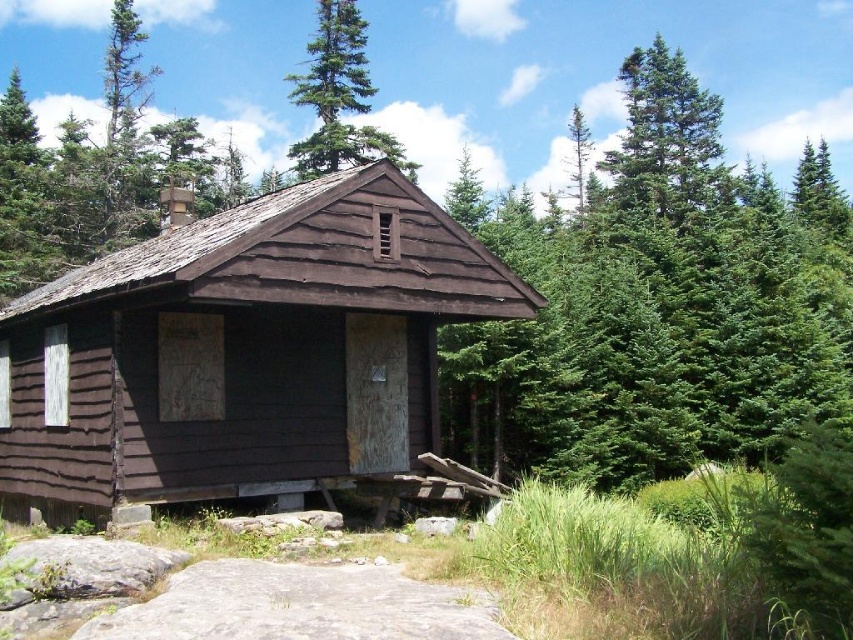
Is the position of brown wooden cabin at center less distant than that of green coniferous tree at upper center?

That is True.

Does point (213, 332) lie behind point (339, 42)?

No, (213, 332) is in front of (339, 42).

At what (x,y) coordinates should I click in order to perform the action: click on brown wooden cabin at center. Please return your answer as a coordinate pair (x, y). The height and width of the screenshot is (640, 853). Looking at the image, I should click on tap(244, 349).

The height and width of the screenshot is (640, 853). In order to click on green evergreen tree at center in this screenshot , I will do `click(654, 305)`.

Is green evergreen tree at center positioned before green coniferous tree at upper center?

Yes, green evergreen tree at center is closer to the viewer.

Find the location of a particular element. green evergreen tree at center is located at coordinates (654, 305).

Who is more forward, (229, 240) or (746, 275)?

Positioned in front is point (229, 240).

What do you see at coordinates (244, 349) in the screenshot? I see `brown wooden cabin at center` at bounding box center [244, 349].

Is point (173, 300) positioned in front of point (614, 336)?

That is True.

You are a GUI agent. You are given a task and a screenshot of the screen. Output one action in this format:
    pyautogui.click(x=<x>, y=<y>)
    Task: Click on the brown wooden cabin at center
    This screenshot has height=640, width=853.
    Given the screenshot: What is the action you would take?
    click(x=244, y=349)